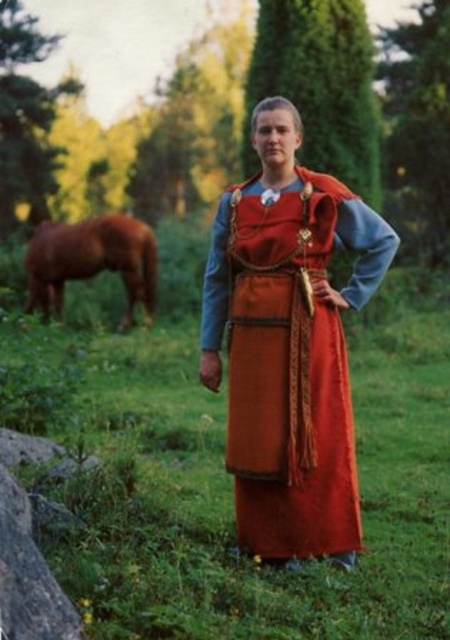
Question: Which of the following is the closest to the observer?

Choices:
 (A) (125, 618)
 (B) (220, 236)

Answer: (A)

Question: Is green grass at center wider than brown glossy horse at left?

Choices:
 (A) yes
 (B) no

Answer: (B)

Question: Estimate the real-world distances between objects in this image. Which object is closer to the green grass at center?

Choices:
 (A) matte orange dress at center
 (B) brown glossy horse at left

Answer: (A)

Question: Is green grass at center to the left of brown glossy horse at left from the viewer's perspective?

Choices:
 (A) yes
 (B) no

Answer: (B)

Question: Which point is closer to the camera?

Choices:
 (A) (58, 282)
 (B) (328, 308)
 (C) (193, 461)

Answer: (B)

Question: Does matte orange dress at center have a greater width compared to brown glossy horse at left?

Choices:
 (A) no
 (B) yes

Answer: (A)